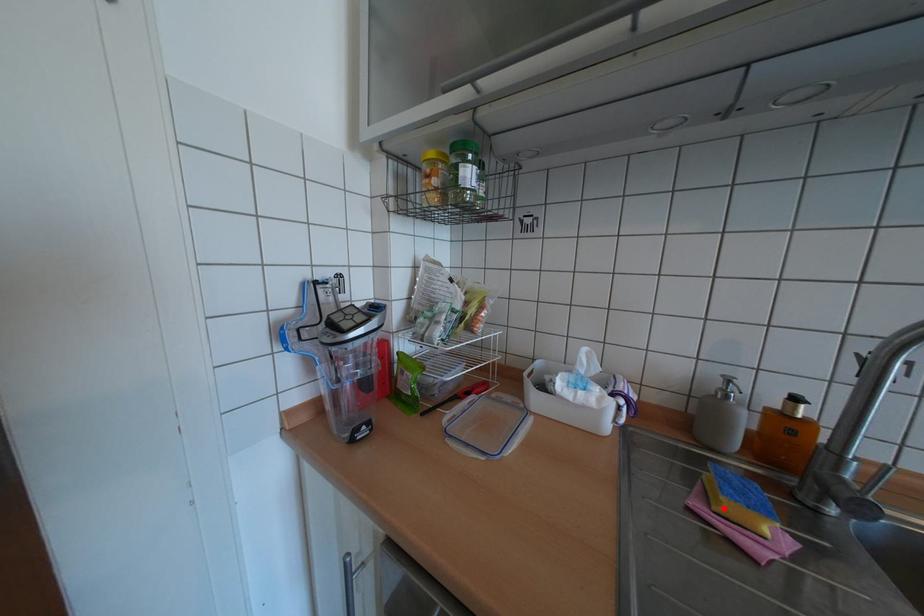
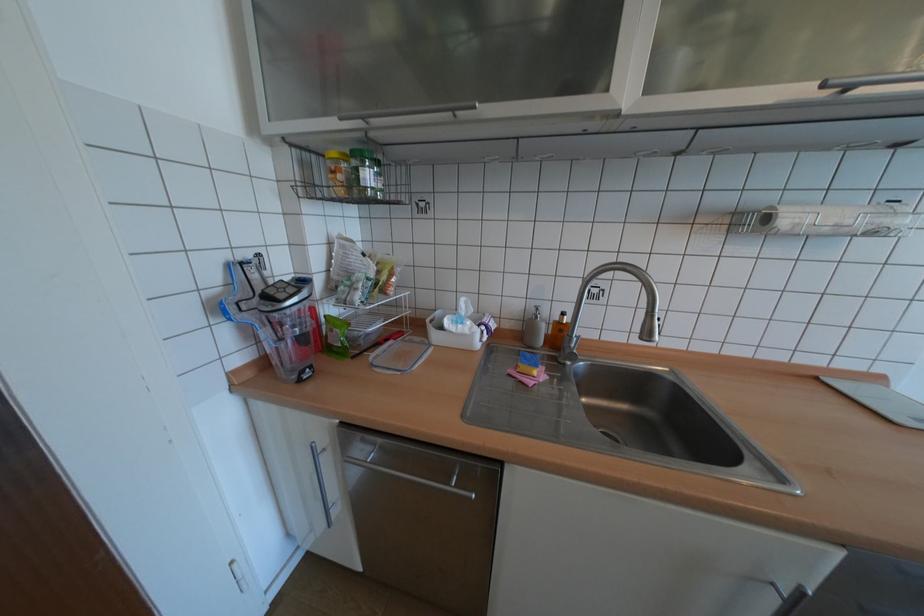
Where in the second image is the point corresponding to the highlighted location from the first image?

(527, 371)